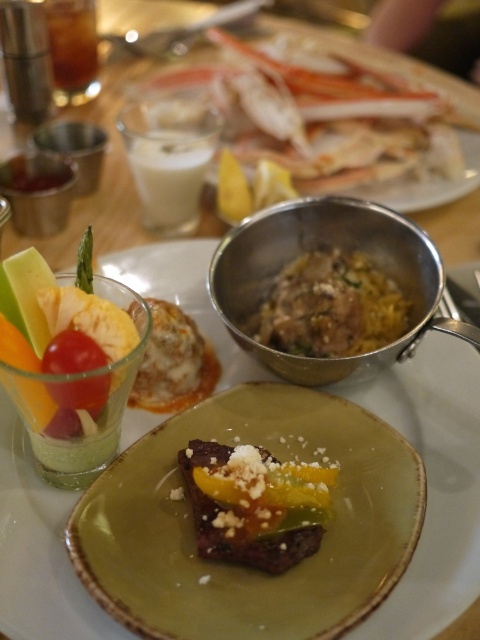
Question: Is crab legs at upper center bigger than crusty brown bread at center?

Choices:
 (A) no
 (B) yes

Answer: (B)

Question: Is yellow rice at center positioned behind crusty brown bread at center?

Choices:
 (A) yes
 (B) no

Answer: (A)

Question: Which point is closer to the camera taking this photo?

Choices:
 (A) pyautogui.click(x=67, y=33)
 (B) pyautogui.click(x=315, y=344)

Answer: (B)

Question: Which object is farther from the camera taking this photo?

Choices:
 (A) brown translucent glass at upper left
 (B) yellow rice at center

Answer: (A)

Question: Is green matte plate at center to the right of saucy bread at center from the viewer's perspective?

Choices:
 (A) no
 (B) yes

Answer: (B)

Question: Which of the following is the closest to the observer?

Choices:
 (A) (322, 253)
 (B) (170, 212)
 (C) (61, 1)
 (D) (257, 557)

Answer: (D)